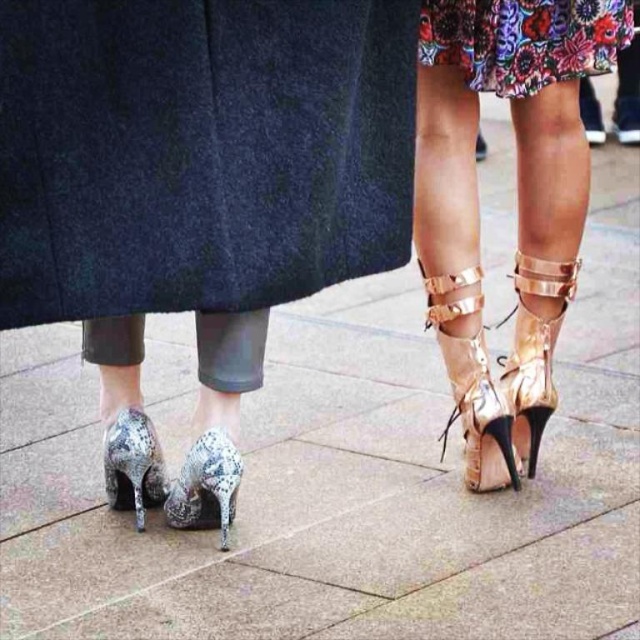
Question: Does gold metallic high-heeled shoe at center-right come in front of metallic gold sandal at right?

Choices:
 (A) yes
 (B) no

Answer: (A)

Question: Based on their relative distances, which object is farther from the metallic gold sandal at right?

Choices:
 (A) floral printed fabric skirt at upper center
 (B) glittery sequined high-heeled shoe at lower left
 (C) gold metallic high-heeled shoe at center-right
 (D) shiny metallic high heels at center

Answer: (B)

Question: Which object is closer to the camera taking this photo?

Choices:
 (A) shiny metallic high heels at center
 (B) gold metallic high-heeled shoe at center-right

Answer: (A)

Question: Which object is closer to the camera taking this photo?

Choices:
 (A) shiny metallic high-heeled shoe at center
 (B) metallic gold high-heeled boots at center

Answer: (B)

Question: Does metallic gold high-heeled boots at center appear on the left side of gold metallic high-heeled shoe at center-right?

Choices:
 (A) yes
 (B) no

Answer: (B)

Question: Can you confirm if metallic gold high-heeled boots at center is positioned below gold metallic high-heeled shoe at center-right?

Choices:
 (A) yes
 (B) no

Answer: (B)